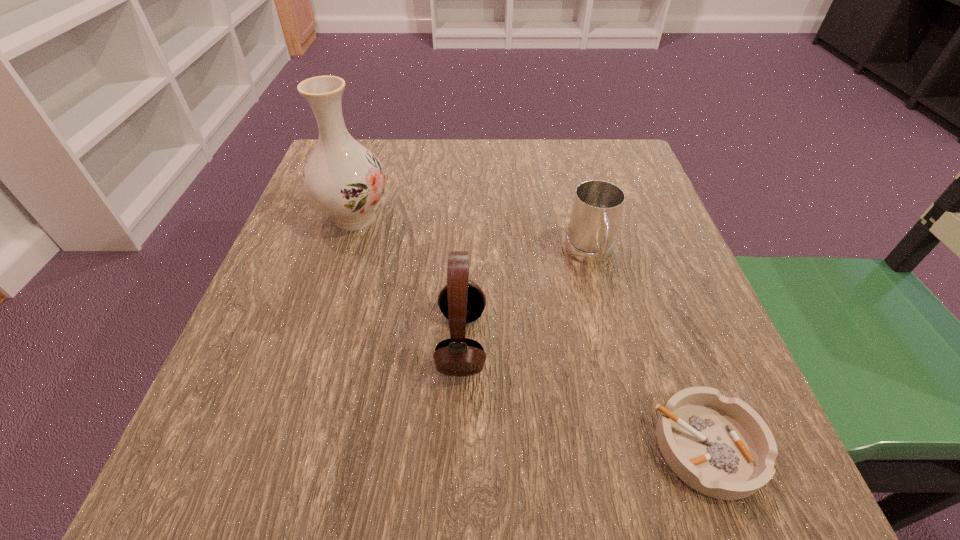
At what (x,y) coordinates should I click in order to perform the action: click on the leftmost object. Please return your answer as a coordinate pair (x, y). Looking at the image, I should click on (342, 178).

Find the location of a particular element. This screenshot has width=960, height=540. the tallest object is located at coordinates (342, 178).

Find the location of a particular element. the second object from left to right is located at coordinates (461, 301).

Find the location of `headset`. headset is located at coordinates (461, 301).

This screenshot has height=540, width=960. Identify the location of the second shortest object. (597, 206).

Locate an element on the screen. ashtray is located at coordinates (721, 447).

I want to click on the nearest object, so 721,447.

At what (x,y) coordinates should I click in order to perform the action: click on vacant space located on the right of the tallest object. Please return your answer as a coordinate pair (x, y). Looking at the image, I should click on (580, 218).

At what (x,y) coordinates should I click in order to perform the action: click on vacant space located 0.060m on the ear pads of the third object from right to left. Please return your answer as a coordinate pair (x, y). Looking at the image, I should click on (524, 342).

This screenshot has height=540, width=960. In order to click on blank space located 0.170m on the side of the third tallest object with the handle in this screenshot , I will do `click(616, 360)`.